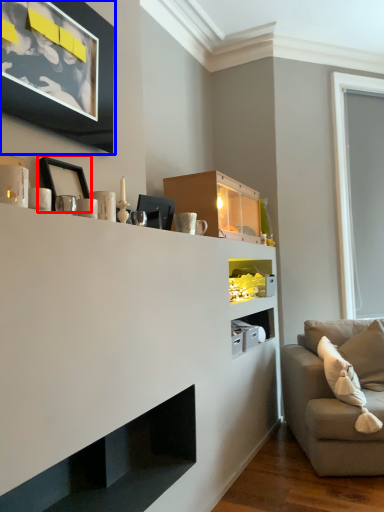
Question: Among these objects, which one is nearest to the camera, picture frame (highlighted by a red box) or picture frame (highlighted by a blue box)?

Choices:
 (A) picture frame
 (B) picture frame

Answer: (B)